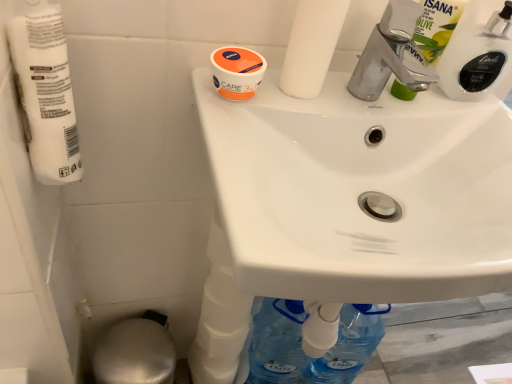
Question: Is white glossy bottle at upper right, which is counted as the first cleaning product, starting from the right, positioned behind white matte toilet paper at upper center, which ranks as the second toilet paper in left-to-right order?

Choices:
 (A) yes
 (B) no

Answer: (A)

Question: From a real-world perspective, is white glossy bottle at upper right, which is counted as the first cleaning product, starting from the right, below white matte toilet paper at upper center, which ranks as the second toilet paper in left-to-right order?

Choices:
 (A) yes
 (B) no

Answer: (A)

Question: Can you see white glossy bottle at upper right, marked as the 2th cleaning product in a left-to-right arrangement, touching white matte toilet paper at upper center, which ranks as the second toilet paper in left-to-right order?

Choices:
 (A) no
 (B) yes

Answer: (A)

Question: Can you confirm if white glossy bottle at upper right, which is counted as the first cleaning product, starting from the right, is shorter than white matte toilet paper at upper center, the 1th toilet paper positioned from the right?

Choices:
 (A) yes
 (B) no

Answer: (A)

Question: From a real-world perspective, is white glossy bottle at upper right, which is counted as the first cleaning product, starting from the right, over white matte toilet paper at upper center, which ranks as the second toilet paper in left-to-right order?

Choices:
 (A) yes
 (B) no

Answer: (B)

Question: Considering the positions of white matte toilet paper at left, the 2th toilet paper in the right-to-left sequence, and silver metallic bidet at lower left in the image, is white matte toilet paper at left, the 2th toilet paper in the right-to-left sequence, bigger or smaller than silver metallic bidet at lower left?

Choices:
 (A) small
 (B) big

Answer: (A)

Question: From the image's perspective, is white matte toilet paper at left, the 2th toilet paper in the right-to-left sequence, positioned above or below silver metallic bidet at lower left?

Choices:
 (A) above
 (B) below

Answer: (A)

Question: Based on their positions, is white matte toilet paper at left, the 2th toilet paper in the right-to-left sequence, located to the left or right of silver metallic bidet at lower left?

Choices:
 (A) right
 (B) left

Answer: (A)

Question: From a real-world perspective, relative to silver metallic bidet at lower left, is white matte toilet paper at left, the 2th toilet paper in the right-to-left sequence, vertically above or below?

Choices:
 (A) above
 (B) below

Answer: (A)

Question: Considering the positions of silver metallic bidet at lower left and white glossy bottle at upper right, which is counted as the first cleaning product, starting from the right, in the image, is silver metallic bidet at lower left wider or thinner than white glossy bottle at upper right, which is counted as the first cleaning product, starting from the right,?

Choices:
 (A) wide
 (B) thin

Answer: (A)

Question: Considering the positions of silver metallic bidet at lower left and white glossy bottle at upper right, marked as the 2th cleaning product in a left-to-right arrangement, in the image, is silver metallic bidet at lower left bigger or smaller than white glossy bottle at upper right, marked as the 2th cleaning product in a left-to-right arrangement,?

Choices:
 (A) small
 (B) big

Answer: (B)

Question: Considering the positions of point (117, 339) and point (509, 51), is point (117, 339) closer or farther from the camera than point (509, 51)?

Choices:
 (A) farther
 (B) closer

Answer: (A)

Question: Considering their positions, is silver metallic bidet at lower left located in front of or behind white glossy bottle at upper right, which is counted as the first cleaning product, starting from the right?

Choices:
 (A) front
 (B) behind

Answer: (B)

Question: Is white matte toilet paper at left, the 2th toilet paper in the right-to-left sequence, in front of or behind white matte toilet paper at upper center, which ranks as the second toilet paper in left-to-right order, in the image?

Choices:
 (A) behind
 (B) front

Answer: (B)

Question: Considering the positions of point tap(42, 33) and point tap(321, 21), is point tap(42, 33) closer or farther from the camera than point tap(321, 21)?

Choices:
 (A) closer
 (B) farther

Answer: (A)